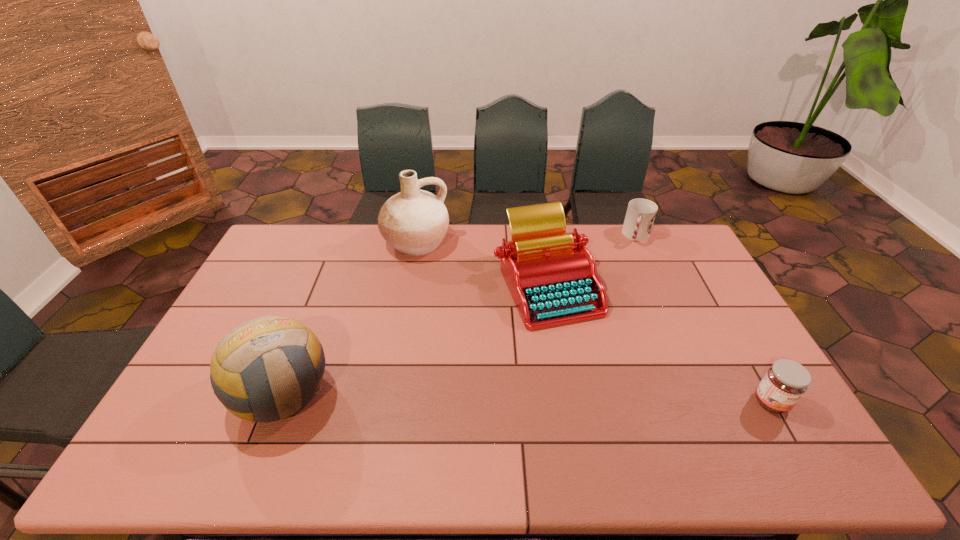
Find the location of a particular element. Image resolution: width=960 pixels, height=540 pixels. vacant area between the volleyball and the jam is located at coordinates (527, 398).

Where is `free spot between the cup and the fourth shortest object`? free spot between the cup and the fourth shortest object is located at coordinates (460, 315).

Image resolution: width=960 pixels, height=540 pixels. I want to click on vacant space that's between the leftmost object and the rightmost object, so click(527, 398).

Identify the location of vacant space that's between the leftmost object and the rightmost object. (527, 398).

At what (x,y) coordinates should I click in order to perform the action: click on object that is the second closest to the third tallest object. Please return your answer as a coordinate pair (x, y). The height and width of the screenshot is (540, 960). Looking at the image, I should click on pyautogui.click(x=414, y=222).

Locate which object is the third closest to the second object from right to left. Please provide its 2D coordinates. Your answer should be formatted as a tuple, i.e. [(x, y)], where the tuple contains the x and y coordinates of a point satisfying the conditions above.

[(414, 222)]

Where is `vacant space that satisfies the following two spatial constraints: 1. on the back side of the third shortest object; 2. on the right side of the cup`? This screenshot has width=960, height=540. vacant space that satisfies the following two spatial constraints: 1. on the back side of the third shortest object; 2. on the right side of the cup is located at coordinates (538, 236).

The width and height of the screenshot is (960, 540). Find the location of `vacant region that satisfies the following two spatial constraints: 1. on the back side of the third object from left to right; 2. on the right side of the volleyball`. vacant region that satisfies the following two spatial constraints: 1. on the back side of the third object from left to right; 2. on the right side of the volleyball is located at coordinates (326, 285).

Find the location of `blank space that satisfies the following two spatial constraints: 1. on the front side of the third tallest object; 2. on the left side of the fourth object from right to left`. blank space that satisfies the following two spatial constraints: 1. on the front side of the third tallest object; 2. on the left side of the fourth object from right to left is located at coordinates click(x=408, y=285).

Where is `free space that satisfies the following two spatial constraints: 1. on the front side of the leftmost object; 2. on the left side of the jam`? The height and width of the screenshot is (540, 960). free space that satisfies the following two spatial constraints: 1. on the front side of the leftmost object; 2. on the left side of the jam is located at coordinates (280, 402).